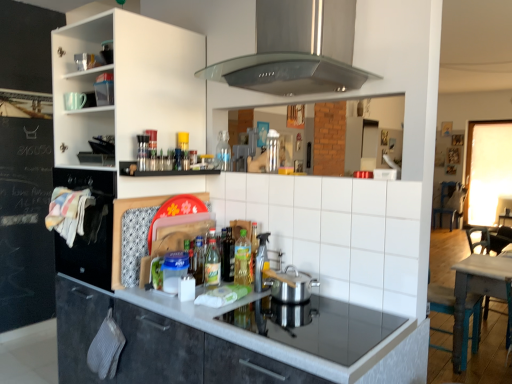
Question: From the image's perspective, is green plastic bottle at center, the 3th bottle in the top-to-bottom sequence, on translucent plastic bottles at center, positioned as the second bottle in back-to-front order?

Choices:
 (A) yes
 (B) no

Answer: (B)

Question: Is green plastic bottle at center, positioned as the 2th bottle in bottom-to-top order, far from translucent plastic bottles at center, which is the third bottle from front to back?

Choices:
 (A) yes
 (B) no

Answer: (B)

Question: Is green plastic bottle at center, which is counted as the 2th bottle, starting from the front, touching translucent plastic bottles at center, the 2th bottle when ordered from top to bottom?

Choices:
 (A) no
 (B) yes

Answer: (A)

Question: Can you confirm if green plastic bottle at center, positioned as the 2th bottle in bottom-to-top order, is smaller than translucent plastic bottles at center, the 2th bottle when ordered from top to bottom?

Choices:
 (A) no
 (B) yes

Answer: (A)

Question: Considering the relative sizes of green plastic bottle at center, the 3th bottle in the top-to-bottom sequence, and translucent plastic bottles at center, positioned as the second bottle in back-to-front order, in the image provided, is green plastic bottle at center, the 3th bottle in the top-to-bottom sequence, bigger than translucent plastic bottles at center, positioned as the second bottle in back-to-front order,?

Choices:
 (A) yes
 (B) no

Answer: (A)

Question: Would you say dark gray laminate cabinet at center is to the left or to the right of wooden table at right in the picture?

Choices:
 (A) left
 (B) right

Answer: (A)

Question: Does point (177, 367) appear closer or farther from the camera than point (495, 263)?

Choices:
 (A) farther
 (B) closer

Answer: (B)

Question: Is dark gray laminate cabinet at center taller or shorter than wooden table at right?

Choices:
 (A) short
 (B) tall

Answer: (A)

Question: Looking at the image, does dark gray laminate cabinet at center seem bigger or smaller compared to wooden table at right?

Choices:
 (A) big
 (B) small

Answer: (B)

Question: Looking at their shapes, would you say clear glass bottle at center, the 4th bottle when ordered from bottom to top, is wider or thinner than wooden table at right?

Choices:
 (A) wide
 (B) thin

Answer: (B)

Question: Is clear glass bottle at center, the 4th bottle when ordered from bottom to top, taller or shorter than wooden table at right?

Choices:
 (A) short
 (B) tall

Answer: (A)

Question: From a real-world perspective, is clear glass bottle at center, the 1th bottle viewed from the back, above or below wooden table at right?

Choices:
 (A) below
 (B) above

Answer: (B)

Question: From the image's perspective, is clear glass bottle at center, the 4th bottle in the front-to-back sequence, above or below wooden table at right?

Choices:
 (A) below
 (B) above

Answer: (B)

Question: Considering the positions of matte white cup at upper left, which is counted as the second appliance, starting from the bottom, and white ceramic tile at center in the image, is matte white cup at upper left, which is counted as the second appliance, starting from the bottom, taller or shorter than white ceramic tile at center?

Choices:
 (A) tall
 (B) short

Answer: (B)

Question: Is matte white cup at upper left, which is the first appliance in top-to-bottom order, bigger or smaller than white ceramic tile at center?

Choices:
 (A) small
 (B) big

Answer: (A)